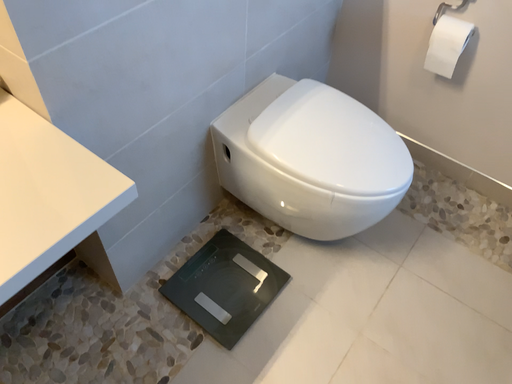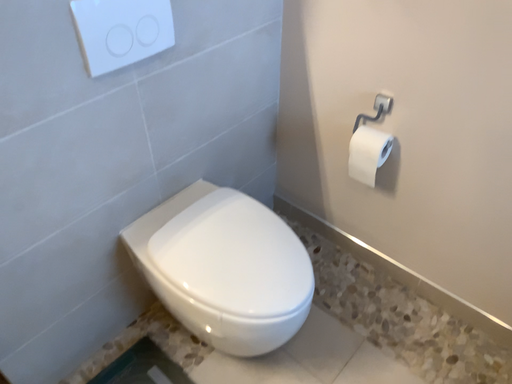
Question: How did the camera likely rotate when shooting the video?

Choices:
 (A) rotated downward
 (B) rotated upward

Answer: (B)